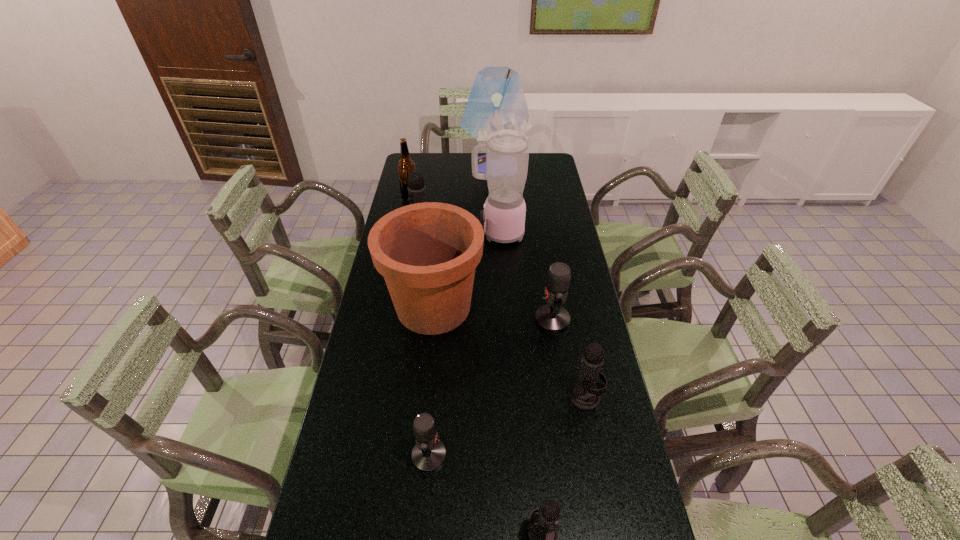
I want to click on microphone present at the left edge, so click(x=416, y=187).

I want to click on lampshade located in the right edge section of the desktop, so click(x=496, y=102).

The height and width of the screenshot is (540, 960). In order to click on object located in the far right corner section of the desktop in this screenshot , I will do `click(496, 102)`.

In the image, there is a desktop. Identify the location of blank space at the far edge. The image size is (960, 540). (468, 161).

I want to click on vacant space at the left edge of the desktop, so click(389, 328).

Identify the location of vacant region at the right edge of the desktop. (577, 273).

Find the location of a particular element. blank space at the far left corner is located at coordinates (426, 156).

Where is `free space between the second farthest object and the lampshade`? The height and width of the screenshot is (540, 960). free space between the second farthest object and the lampshade is located at coordinates (453, 183).

Where is `vacant point located between the light lampshade and the farthest black microphone`? The width and height of the screenshot is (960, 540). vacant point located between the light lampshade and the farthest black microphone is located at coordinates (458, 201).

Find the location of `blank region between the farther red microphone and the food processor`. blank region between the farther red microphone and the food processor is located at coordinates (525, 276).